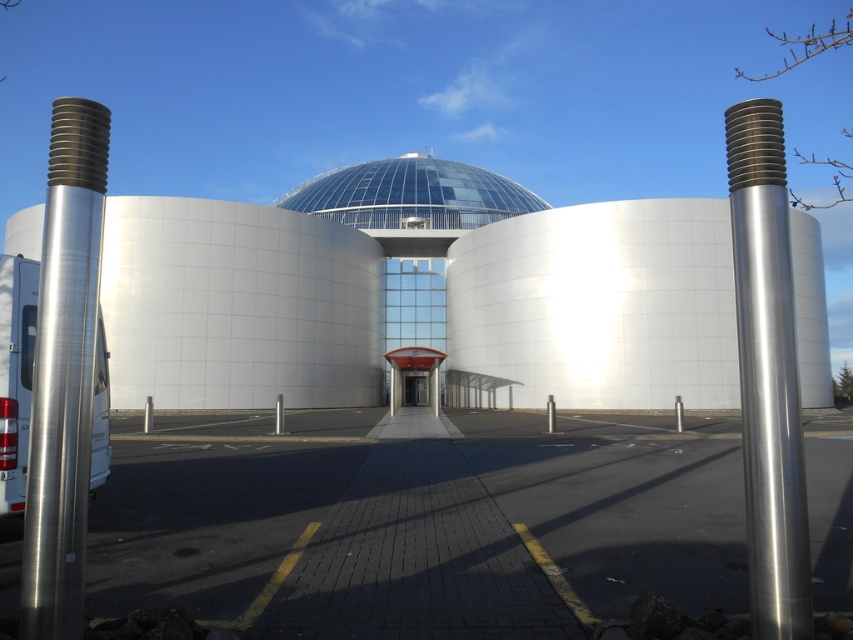
Question: Can you confirm if polished metallic pole at right is smaller than transparent glass dome at center?

Choices:
 (A) yes
 (B) no

Answer: (A)

Question: Is polished silver pole at left smaller than polished metallic pole at right?

Choices:
 (A) no
 (B) yes

Answer: (B)

Question: Which object is the farthest from the transparent glass dome at center?

Choices:
 (A) polished silver pole at left
 (B) polished metallic pole at right

Answer: (A)

Question: Does polished metallic pole at right appear over transparent glass dome at center?

Choices:
 (A) no
 (B) yes

Answer: (A)

Question: Which point is closer to the camera?

Choices:
 (A) (102, 136)
 (B) (762, 552)
 (C) (390, 218)

Answer: (B)

Question: Which of the following is the farthest from the observer?

Choices:
 (A) transparent glass dome at center
 (B) polished metallic pole at right
 (C) polished silver pole at left

Answer: (A)